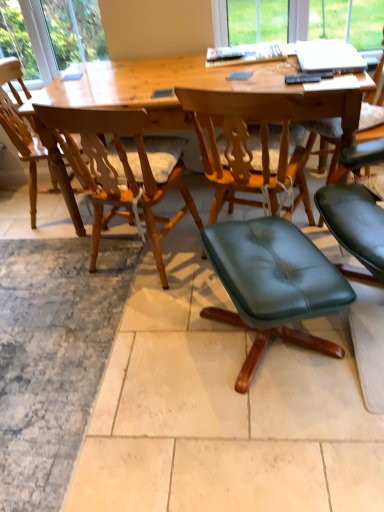
Where is `free spot above wooden desk at center (from a real-world perspective)`? free spot above wooden desk at center (from a real-world perspective) is located at coordinates (180, 80).